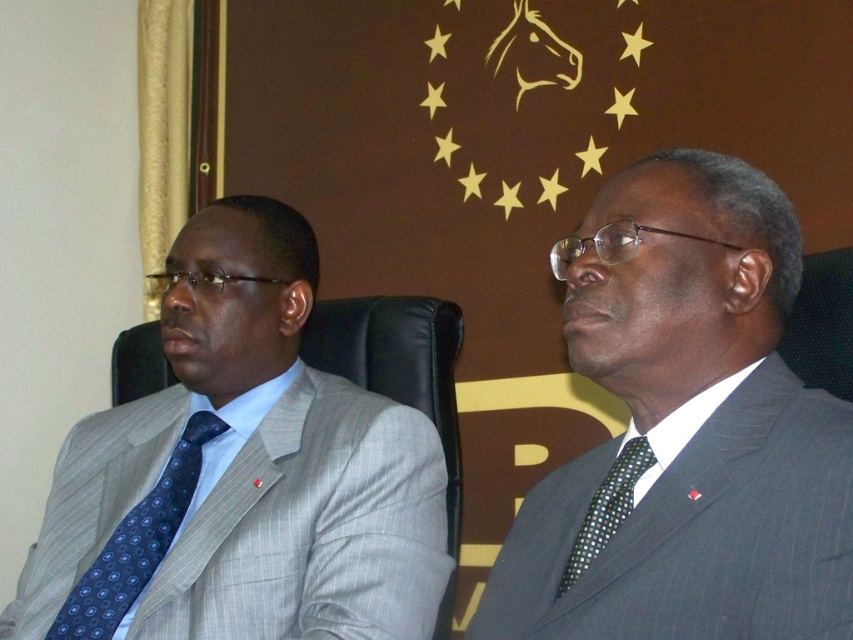
Question: Which object is positioned farthest from the gray pinstripe suit at left?

Choices:
 (A) blue dotted tie at left
 (B) black dotted tie at right
 (C) dark gray pinstripe suit at right

Answer: (B)

Question: Which object appears closest to the camera in this image?

Choices:
 (A) blue dotted tie at left
 (B) gray pinstripe suit at left

Answer: (B)

Question: From the image, what is the correct spatial relationship of blue dotted tie at left in relation to black dotted tie at right?

Choices:
 (A) above
 (B) below

Answer: (B)

Question: Can you confirm if blue dotted tie at left is positioned below black dotted tie at right?

Choices:
 (A) no
 (B) yes

Answer: (B)

Question: Is dark gray pinstripe suit at right further to the viewer compared to gray pinstripe suit at left?

Choices:
 (A) no
 (B) yes

Answer: (A)

Question: Among these objects, which one is nearest to the camera?

Choices:
 (A) black dotted tie at right
 (B) dark gray pinstripe suit at right
 (C) gray pinstripe suit at left

Answer: (B)